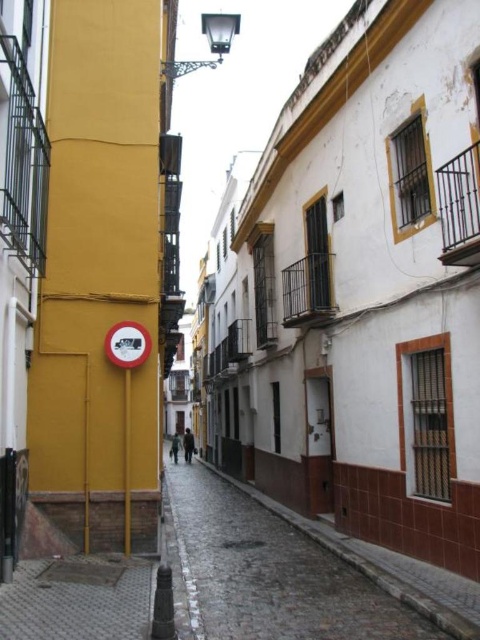
Question: From the image, what is the correct spatial relationship of cobblestone pavement at center in relation to gray textured pavement at lower left?

Choices:
 (A) above
 (B) below

Answer: (B)

Question: Where is gray textured pavement at lower left located in relation to red plastic circle at center in the image?

Choices:
 (A) above
 (B) below

Answer: (B)

Question: Which point appears closest to the camera in this image?

Choices:
 (A) (131, 522)
 (B) (224, 616)

Answer: (B)

Question: Which of the following is the farthest from the observer?

Choices:
 (A) smooth yellow pole at center
 (B) cobblestone pavement at center
 (C) red plastic circle at center
 (D) gray textured pavement at lower left

Answer: (C)

Question: Can you confirm if cobblestone pavement at center is positioned below gray textured pavement at lower left?

Choices:
 (A) no
 (B) yes

Answer: (B)

Question: Which object is positioned farthest from the smooth yellow pole at center?

Choices:
 (A) gray textured pavement at lower left
 (B) cobblestone pavement at center
 (C) red plastic circle at center

Answer: (B)